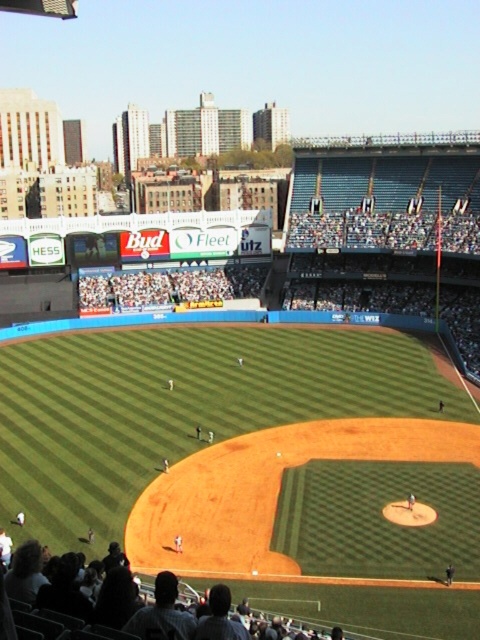
You are a player standing at the pitcher mound and want to throw a ball to the point at point (x=58, y=397) and point (x=74, y=620). Which point is farther from you?

Point (x=58, y=397) is behind point (x=74, y=620), so the point at (x=58, y=397) is farther from you.

You are a spectator sitting on the dark gray fabric seats at lower center. You want to watch the game happening on the green grass baseball field at center. Which direction should you look to see the game clearly?

The green grass baseball field at center is positioned over the dark gray fabric seats at lower center, so you should look upward to see the game clearly.